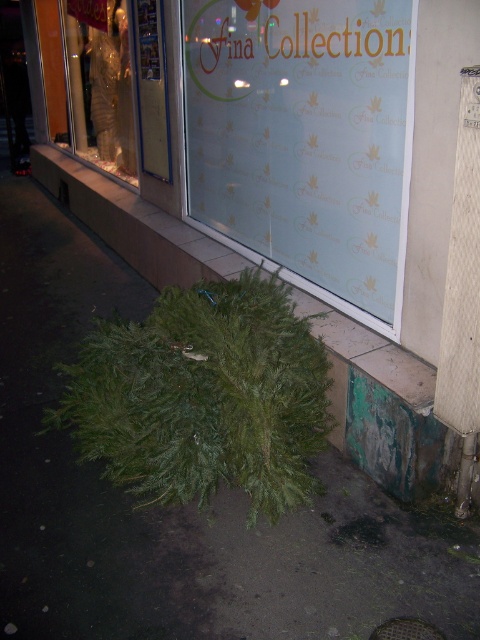
You are a delivery person trying to place a large package on the sidewalk in front of the storefront. The package is 1.2 meters wide. Can you place it between the green leafy wreath at lower center and the frosted glass window at center without overlapping either object?

The green leafy wreath at lower center is wider than the frosted glass window at center. Since the package is 1.2 meters wide, it may not fit between them if the space between the wreath and the window is narrower than 1.2 meters. However, the exact distance isn

You are standing 10 feet away from the storefront. You want to pick up the green leafy wreath at lower center. Can you reach it without moving closer?

The green leafy wreath at lower center is 5.69 feet away from the camera. Since you are standing 10 feet away from the storefront, the wreath is further away than your current position. You would need to move closer to reach it.